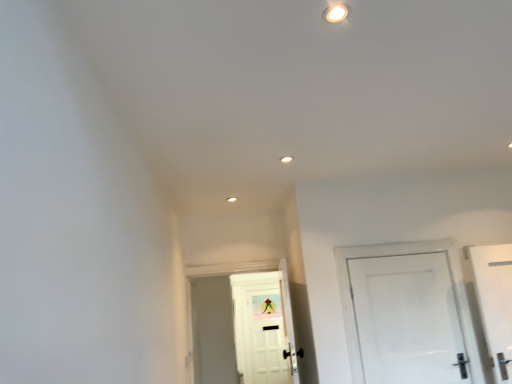
Measure the distance between point (243, 322) and camera.

Point (243, 322) is 4.82 meters away from camera.

The height and width of the screenshot is (384, 512). I want to click on white matte door at center, which is counted as the first door, starting from the left, so click(x=262, y=327).

What do you see at coordinates (262, 327) in the screenshot? I see `white matte door at center, the 2th door in the right-to-left sequence` at bounding box center [262, 327].

This screenshot has width=512, height=384. What do you see at coordinates (407, 319) in the screenshot? I see `white glossy door at right, placed as the 2th door when sorted from back to front` at bounding box center [407, 319].

Locate an element on the screen. This screenshot has width=512, height=384. white glossy door at right, placed as the 2th door when sorted from back to front is located at coordinates (407, 319).

Where is `white matte door at center, which is counted as the first door, starting from the left`? Image resolution: width=512 pixels, height=384 pixels. white matte door at center, which is counted as the first door, starting from the left is located at coordinates (262, 327).

Considering the positions of objects white matte door at center, which is counted as the 1th door, starting from the back, and white glossy door at right, the second door viewed from the left, in the image provided, who is more to the left, white matte door at center, which is counted as the 1th door, starting from the back, or white glossy door at right, the second door viewed from the left,?

Positioned to the left is white matte door at center, which is counted as the 1th door, starting from the back.

Is the position of white matte door at center, the 2th door in the right-to-left sequence, more distant than that of white glossy door at right, which is the 1th door from front to back?

Yes, the depth of white matte door at center, the 2th door in the right-to-left sequence, is greater than that of white glossy door at right, which is the 1th door from front to back.

Does point (243, 331) appear closer or farther from the camera than point (355, 267)?

Point (243, 331) is positioned farther from the camera compared to point (355, 267).

From the image's perspective, which one is positioned lower, white matte door at center, the 2th door in the right-to-left sequence, or white glossy door at right, placed as the 2th door when sorted from back to front?

white matte door at center, the 2th door in the right-to-left sequence, from the image's perspective.

From a real-world perspective, relative to white glossy door at right, the second door viewed from the left, is white matte door at center, which is the 2th door from front to back, vertically above or below?

Clearly, from a real-world perspective, white matte door at center, which is the 2th door from front to back, is above white glossy door at right, the second door viewed from the left.

Which object is wider, white matte door at center, the 2th door in the right-to-left sequence, or white glossy door at right, the second door viewed from the left?

white matte door at center, the 2th door in the right-to-left sequence, is wider.

Does white matte door at center, the 2th door in the right-to-left sequence, have a greater height compared to white glossy door at right, placed as the 2th door when sorted from back to front?

Yes.

From the picture: Based on their sizes in the image, would you say white matte door at center, the 2th door in the right-to-left sequence, is bigger or smaller than white glossy door at right, placed as the 2th door when sorted from back to front?

Clearly, white matte door at center, the 2th door in the right-to-left sequence, is larger in size than white glossy door at right, placed as the 2th door when sorted from back to front.

Is white matte door at center, the 2th door in the right-to-left sequence, completely or partially outside of white glossy door at right, which is the 1th door from front to back?

Yes, white matte door at center, the 2th door in the right-to-left sequence, is not within white glossy door at right, which is the 1th door from front to back.

Is white matte door at center, which is counted as the first door, starting from the left, directly adjacent to white glossy door at right, placed as the 2th door when sorted from back to front?

No, white matte door at center, which is counted as the first door, starting from the left, is not making contact with white glossy door at right, placed as the 2th door when sorted from back to front.

Could you tell me if white matte door at center, which is counted as the 1th door, starting from the back, is turned towards white glossy door at right, placed as the 2th door when sorted from back to front?

No, white matte door at center, which is counted as the 1th door, starting from the back, is not aimed at white glossy door at right, placed as the 2th door when sorted from back to front.

Can you tell me how much white matte door at center, which is counted as the 1th door, starting from the back, and white glossy door at right, the second door viewed from the left, differ in facing direction?

The facing directions of white matte door at center, which is counted as the 1th door, starting from the back, and white glossy door at right, the second door viewed from the left, are 1.34 degrees apart.

Where is `door in front of the white matte door at center, which is the 2th door from front to back`? The height and width of the screenshot is (384, 512). door in front of the white matte door at center, which is the 2th door from front to back is located at coordinates (407, 319).

Which object is positioned more to the right, white glossy door at right, the second door viewed from the left, or white matte door at center, which is counted as the first door, starting from the left?

From the viewer's perspective, white glossy door at right, the second door viewed from the left, appears more on the right side.

Which object is further away from the camera, white glossy door at right, the first door viewed from the right, or white matte door at center, the 2th door in the right-to-left sequence?

white matte door at center, the 2th door in the right-to-left sequence, is further from the camera.

Considering the points (413, 333) and (285, 381), which point is in front, point (413, 333) or point (285, 381)?

The point (413, 333) is closer to the camera.

From the image's perspective, between white glossy door at right, placed as the 2th door when sorted from back to front, and white matte door at center, which is counted as the 1th door, starting from the back, which one is located above?

white glossy door at right, placed as the 2th door when sorted from back to front.

From a real-world perspective, is white glossy door at right, which is the 1th door from front to back, physically located above or below white matte door at center, which is the 2th door from front to back?

From a real-world perspective, white glossy door at right, which is the 1th door from front to back, is physically below white matte door at center, which is the 2th door from front to back.

Between white glossy door at right, placed as the 2th door when sorted from back to front, and white matte door at center, which is counted as the first door, starting from the left, which one has smaller width?

Thinner between the two is white glossy door at right, placed as the 2th door when sorted from back to front.

Consider the image. Between white glossy door at right, which is the 1th door from front to back, and white matte door at center, which is counted as the first door, starting from the left, which one has less height?

With less height is white glossy door at right, which is the 1th door from front to back.

Between white glossy door at right, which is the 1th door from front to back, and white matte door at center, which is counted as the 1th door, starting from the back, which one has smaller size?

With smaller size is white glossy door at right, which is the 1th door from front to back.

Is white glossy door at right, the second door viewed from the left, surrounding white matte door at center, which is counted as the 1th door, starting from the back?

No, white matte door at center, which is counted as the 1th door, starting from the back, is not inside white glossy door at right, the second door viewed from the left.

Is white glossy door at right, the first door viewed from the right, next to white matte door at center, the 2th door in the right-to-left sequence, and touching it?

white glossy door at right, the first door viewed from the right, and white matte door at center, the 2th door in the right-to-left sequence, are clearly separated.

Is white glossy door at right, the second door viewed from the left, looking in the opposite direction of white matte door at center, which is counted as the first door, starting from the left?

No, white glossy door at right, the second door viewed from the left, is not facing away from white matte door at center, which is counted as the first door, starting from the left.

Where is `door that is in front of the white matte door at center, which is counted as the 1th door, starting from the back`? The height and width of the screenshot is (384, 512). door that is in front of the white matte door at center, which is counted as the 1th door, starting from the back is located at coordinates [407, 319].

The width and height of the screenshot is (512, 384). I want to click on door on the left of white glossy door at right, which is the 1th door from front to back, so click(x=262, y=327).

What are the coordinates of `door on the right of white matte door at center, which is counted as the 1th door, starting from the back` in the screenshot? It's located at (407, 319).